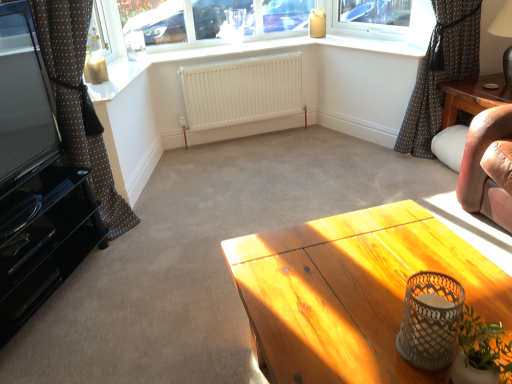
At what (x,y) coordinates should I click in order to perform the action: click on free space in front of white matte radiator at center. Please return your answer as a coordinate pair (x, y). Looking at the image, I should click on (267, 184).